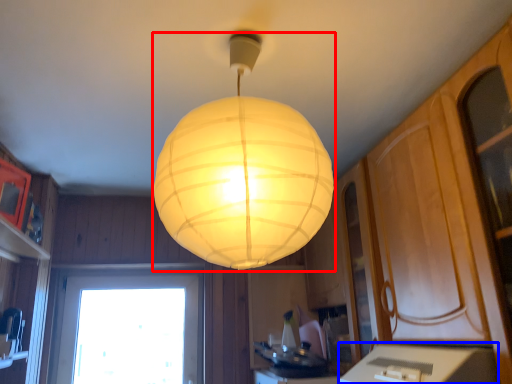
Question: Among these objects, which one is nearest to the camera, lamp (highlighted by a red box) or counter top (highlighted by a blue box)?

Choices:
 (A) lamp
 (B) counter top

Answer: (A)